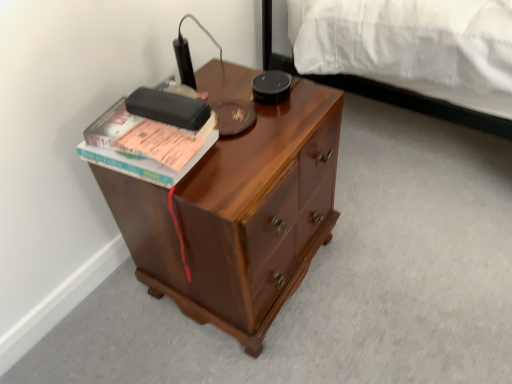
Image resolution: width=512 pixels, height=384 pixels. What are the coordinates of `empty space that is ontop of shiny brown wooden desk at center (from a real-world perspective)` in the screenshot? It's located at (251, 120).